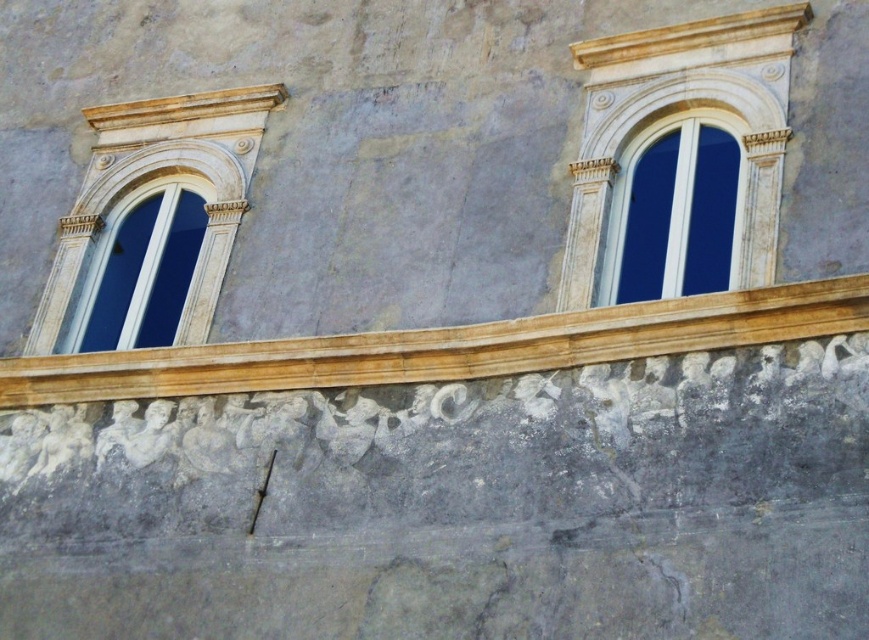
Question: Is the position of golden stone ledge at center more distant than that of white marble window at upper right?

Choices:
 (A) yes
 (B) no

Answer: (B)

Question: Which of the following is the closest to the observer?

Choices:
 (A) golden stone ledge at center
 (B) white marble window at upper right
 (C) matte white window at left

Answer: (A)

Question: Does white marble window at upper right have a lesser width compared to matte white window at left?

Choices:
 (A) yes
 (B) no

Answer: (B)

Question: Among these objects, which one is nearest to the camera?

Choices:
 (A) matte white window at left
 (B) white marble window at upper right

Answer: (B)

Question: Can you confirm if golden stone ledge at center is wider than matte white window at left?

Choices:
 (A) no
 (B) yes

Answer: (B)

Question: Which of these objects is positioned closest to the golden stone ledge at center?

Choices:
 (A) white marble window at upper right
 (B) matte white window at left

Answer: (A)